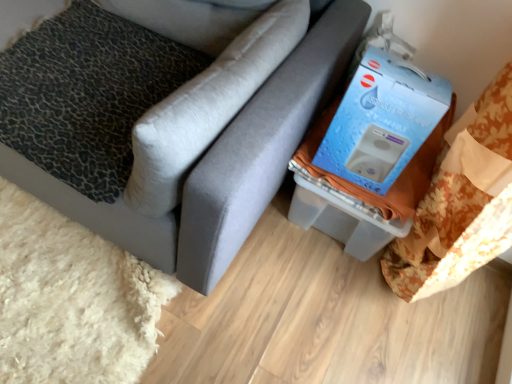
Question: Is the depth of blue cardboard box at upper right greater than that of leopard print fabric pillow at left, the first pillow from the right?

Choices:
 (A) no
 (B) yes

Answer: (B)

Question: Can you confirm if blue cardboard box at upper right is taller than leopard print fabric pillow at left, which is counted as the second pillow, starting from the left?

Choices:
 (A) no
 (B) yes

Answer: (A)

Question: Is blue cardboard box at upper right not within leopard print fabric pillow at left, which is counted as the second pillow, starting from the left?

Choices:
 (A) yes
 (B) no

Answer: (A)

Question: Can you confirm if blue cardboard box at upper right is smaller than leopard print fabric pillow at left, the first pillow from the right?

Choices:
 (A) no
 (B) yes

Answer: (B)

Question: From the image's perspective, would you say blue cardboard box at upper right is positioned over leopard print fabric pillow at left, which is counted as the second pillow, starting from the left?

Choices:
 (A) no
 (B) yes

Answer: (A)

Question: Would you say blue cardboard box at upper right contains leopard print fabric pillow at left, the first pillow from the right?

Choices:
 (A) no
 (B) yes

Answer: (A)

Question: Can you confirm if leopard print fabric pillow at left, the first pillow in the left-to-right sequence, is smaller than leopard print fabric pillow at left, the first pillow from the right?

Choices:
 (A) no
 (B) yes

Answer: (B)

Question: Is leopard print fabric pillow at left, the first pillow in the left-to-right sequence, behind leopard print fabric pillow at left, the first pillow from the right?

Choices:
 (A) no
 (B) yes

Answer: (B)

Question: Is leopard print fabric pillow at left, which is counted as the second pillow, starting from the left, surrounded by leopard print fabric pillow at left, which is the 2th pillow in right-to-left order?

Choices:
 (A) yes
 (B) no

Answer: (B)

Question: Is leopard print fabric pillow at left, the first pillow in the left-to-right sequence, taller than leopard print fabric pillow at left, the first pillow from the right?

Choices:
 (A) yes
 (B) no

Answer: (B)

Question: Is leopard print fabric pillow at left, the first pillow in the left-to-right sequence, in front of leopard print fabric pillow at left, the first pillow from the right?

Choices:
 (A) yes
 (B) no

Answer: (B)

Question: From a real-world perspective, is blue cardboard box at upper right positioned under leopard print fabric pillow at left, which is the 2th pillow in right-to-left order, based on gravity?

Choices:
 (A) yes
 (B) no

Answer: (B)